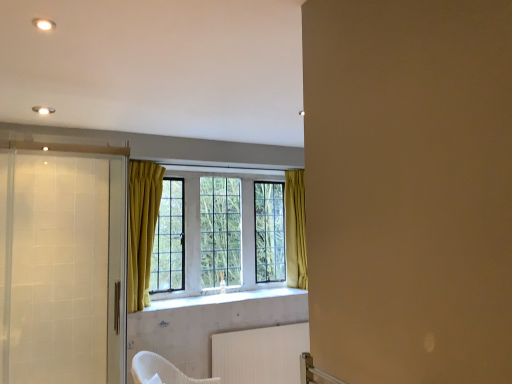
Locate an element on the screen. The height and width of the screenshot is (384, 512). clear glass window at center is located at coordinates (295, 230).

Measure the distance between clear glass screen door at left, which appears as the 1th screen door when viewed from the back, and camera.

clear glass screen door at left, which appears as the 1th screen door when viewed from the back, and camera are 8.14 feet apart from each other.

Find the location of `clear glass window at center`. clear glass window at center is located at coordinates (295, 230).

Is translucent glass screen door at left, which is the second screen door from back to front, situated inside white textured radiator at lower center or outside?

translucent glass screen door at left, which is the second screen door from back to front, exists outside the volume of white textured radiator at lower center.

Considering the positions of point (105, 207) and point (297, 332), is point (105, 207) closer or farther from the camera than point (297, 332)?

Point (105, 207) is positioned closer to the camera compared to point (297, 332).

In terms of height, does translucent glass screen door at left, which is the second screen door from back to front, look taller or shorter compared to white textured radiator at lower center?

Clearly, translucent glass screen door at left, which is the second screen door from back to front, is taller compared to white textured radiator at lower center.

Image resolution: width=512 pixels, height=384 pixels. In order to click on radiator lying on the right of translucent glass screen door at left, which is the second screen door from back to front in this screenshot , I will do `click(260, 354)`.

Between clear glass screen door at left, which appears as the 1th screen door when viewed from the back, and clear glass window at center, which one has smaller size?

Smaller between the two is clear glass screen door at left, which appears as the 1th screen door when viewed from the back.

Can you tell me how much clear glass screen door at left, the 2th screen door when ordered from front to back, and clear glass window at center differ in facing direction?

The facing directions of clear glass screen door at left, the 2th screen door when ordered from front to back, and clear glass window at center are 90.1 degrees apart.

Can clear glass window at center be found inside clear glass screen door at left, the 2th screen door when ordered from front to back?

Actually, clear glass window at center is outside clear glass screen door at left, the 2th screen door when ordered from front to back.

Between clear glass screen door at left, the 2th screen door when ordered from front to back, and clear glass window at center, which one is positioned behind?

clear glass window at center is further away from the camera.

Could you tell me if clear glass window at center is facing white textured tile at center?

Yes, clear glass window at center is oriented towards white textured tile at center.

This screenshot has height=384, width=512. In order to click on window above the white textured tile at center (from the image's perspective) in this screenshot , I will do `click(295, 230)`.

Is point (141, 272) behind point (249, 293)?

No.

Is point (259, 329) positioned before point (228, 297)?

Yes.

Considering the positions of objects white textured radiator at lower center and white textured tile at center in the image provided, who is more to the right, white textured radiator at lower center or white textured tile at center?

Positioned to the right is white textured radiator at lower center.

Can you confirm if white textured radiator at lower center is smaller than white textured tile at center?

Actually, white textured radiator at lower center might be larger than white textured tile at center.

From a real-world perspective, is white textured radiator at lower center under white textured tile at center?

Yes, from a real-world perspective, white textured radiator at lower center is under white textured tile at center.

Is white textured tile at center at the left side of translucent glass screen door at left, the 1th screen door viewed from the front?

No, white textured tile at center is not to the left of translucent glass screen door at left, the 1th screen door viewed from the front.

Are white textured tile at center and translucent glass screen door at left, which is the second screen door from back to front, beside each other?

No, white textured tile at center is not making contact with translucent glass screen door at left, which is the second screen door from back to front.

Is white textured tile at center further to the viewer compared to translucent glass screen door at left, the 1th screen door viewed from the front?

Yes.

In the scene shown: Which of these two, clear glass screen door at left, the 2th screen door when ordered from front to back, or white textured radiator at lower center, is wider?

Wider between the two is white textured radiator at lower center.

Is clear glass screen door at left, the 2th screen door when ordered from front to back, in front of or behind white textured radiator at lower center in the image?

clear glass screen door at left, the 2th screen door when ordered from front to back, is in front of white textured radiator at lower center.

From a real-world perspective, between clear glass screen door at left, the 2th screen door when ordered from front to back, and white textured radiator at lower center, who is vertically higher?

clear glass screen door at left, the 2th screen door when ordered from front to back.

Does clear glass screen door at left, which appears as the 1th screen door when viewed from the back, have a larger size compared to white textured radiator at lower center?

No, clear glass screen door at left, which appears as the 1th screen door when viewed from the back, is not bigger than white textured radiator at lower center.

Looking at their sizes, would you say white textured armchair at lower center is wider or thinner than white textured tile at center?

In the image, white textured armchair at lower center appears to be wider than white textured tile at center.

In the image, is white textured armchair at lower center positioned in front of or behind white textured tile at center?

white textured armchair at lower center is in front of white textured tile at center.

From the image's perspective, between white textured armchair at lower center and white textured tile at center, who is located below?

white textured armchair at lower center is shown below in the image.

The height and width of the screenshot is (384, 512). Find the location of `radiator below the translucent glass screen door at left, the 1th screen door viewed from the front (from the image's perspective)`. radiator below the translucent glass screen door at left, the 1th screen door viewed from the front (from the image's perspective) is located at coordinates (260, 354).

Locate an element on the screen. The image size is (512, 384). the 2nd screen door below the clear glass window at center (from a real-world perspective) is located at coordinates (117, 270).

Which object lies further to the anchor point translucent glass screen door at left, the 1th screen door viewed from the front, clear glass screen door at left, the 2th screen door when ordered from front to back, or white textured armchair at lower center?

white textured armchair at lower center is further to translucent glass screen door at left, the 1th screen door viewed from the front.

Considering their positions, is white textured armchair at lower center positioned closer to translucent glass screen door at left, the 1th screen door viewed from the front, than clear glass window at center?

The object closer to translucent glass screen door at left, the 1th screen door viewed from the front, is clear glass window at center.

Looking at the image, which one is located closer to white textured armchair at lower center, clear glass screen door at left, the 2th screen door when ordered from front to back, or white textured tile at center?

Among the two, clear glass screen door at left, the 2th screen door when ordered from front to back, is located nearer to white textured armchair at lower center.

Based on their spatial positions, is translucent glass screen door at left, which is the second screen door from back to front, or white textured radiator at lower center further from clear glass screen door at left, the 2th screen door when ordered from front to back?

The object further to clear glass screen door at left, the 2th screen door when ordered from front to back, is white textured radiator at lower center.

Looking at the image, which one is located further to translucent glass screen door at left, the 1th screen door viewed from the front, clear glass window at center or white textured tile at center?

The object further to translucent glass screen door at left, the 1th screen door viewed from the front, is white textured tile at center.

Estimate the real-world distances between objects in this image. Which object is closer to white textured radiator at lower center, clear glass window at center or white textured tile at center?

white textured tile at center lies closer to white textured radiator at lower center than the other object.

From the image, which object appears to be nearer to clear glass screen door at left, the 2th screen door when ordered from front to back, clear glass window at center or white textured radiator at lower center?

Among the two, clear glass window at center is located nearer to clear glass screen door at left, the 2th screen door when ordered from front to back.

Looking at the image, which one is located closer to clear glass screen door at left, which appears as the 1th screen door when viewed from the back, white textured armchair at lower center or white textured radiator at lower center?

The object closer to clear glass screen door at left, which appears as the 1th screen door when viewed from the back, is white textured armchair at lower center.

This screenshot has height=384, width=512. I want to click on screen door between translucent glass screen door at left, the 1th screen door viewed from the front, and white textured radiator at lower center from front to back, so click(x=117, y=270).

This screenshot has width=512, height=384. Find the location of `window sill positioned between white textured armchair at lower center and clear glass window at center from near to far`. window sill positioned between white textured armchair at lower center and clear glass window at center from near to far is located at coordinates [223, 298].

Find the location of a particular element. The height and width of the screenshot is (384, 512). window sill between white textured armchair at lower center and white textured radiator at lower center along the z-axis is located at coordinates (223, 298).

The height and width of the screenshot is (384, 512). I want to click on armchair positioned between clear glass screen door at left, the 2th screen door when ordered from front to back, and clear glass window at center from near to far, so click(x=162, y=370).